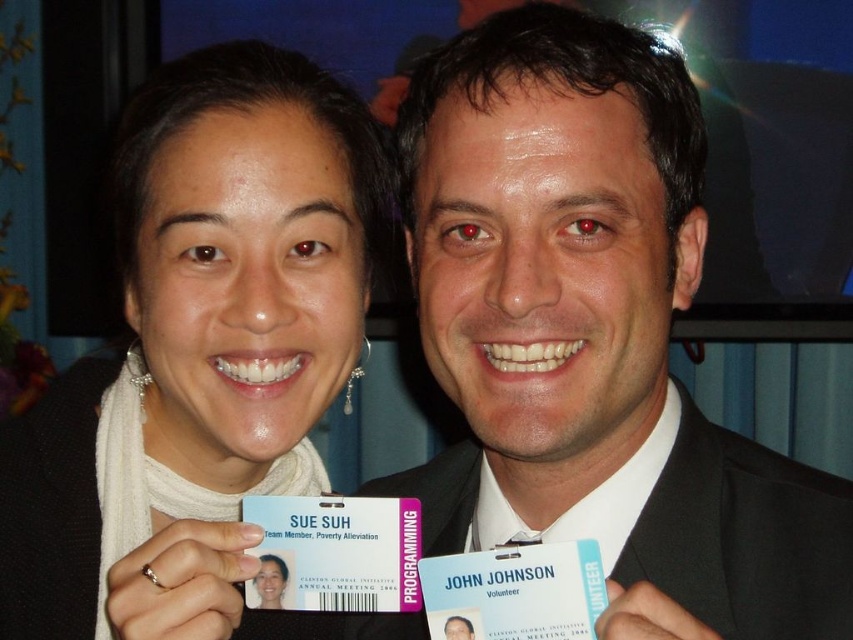
Is black suit at center positioned in front of matte white scarf at upper left?

Yes, black suit at center is in front of matte white scarf at upper left.

Can you confirm if black suit at center is positioned below matte white scarf at upper left?

Actually, black suit at center is above matte white scarf at upper left.

Locate an element on the screen. This screenshot has height=640, width=853. black suit at center is located at coordinates (593, 337).

Identify the location of white fabric scarf at upper left. (196, 342).

Can you confirm if white fabric scarf at upper left is positioned above matte white scarf at upper left?

Indeed, white fabric scarf at upper left is positioned over matte white scarf at upper left.

Is point (352, 266) closer to viewer compared to point (277, 570)?

No, (352, 266) is further to viewer.

In order to click on white fabric scarf at upper left in this screenshot , I will do `click(196, 342)`.

Can you confirm if white fabric scarf at upper left is positioned above blue card at center?

Indeed, white fabric scarf at upper left is positioned over blue card at center.

Is point (125, 259) less distant than point (456, 557)?

No, (125, 259) is behind (456, 557).

What do you see at coordinates (196, 342) in the screenshot?
I see `white fabric scarf at upper left` at bounding box center [196, 342].

Where is `white fabric scarf at upper left`? The height and width of the screenshot is (640, 853). white fabric scarf at upper left is located at coordinates (196, 342).